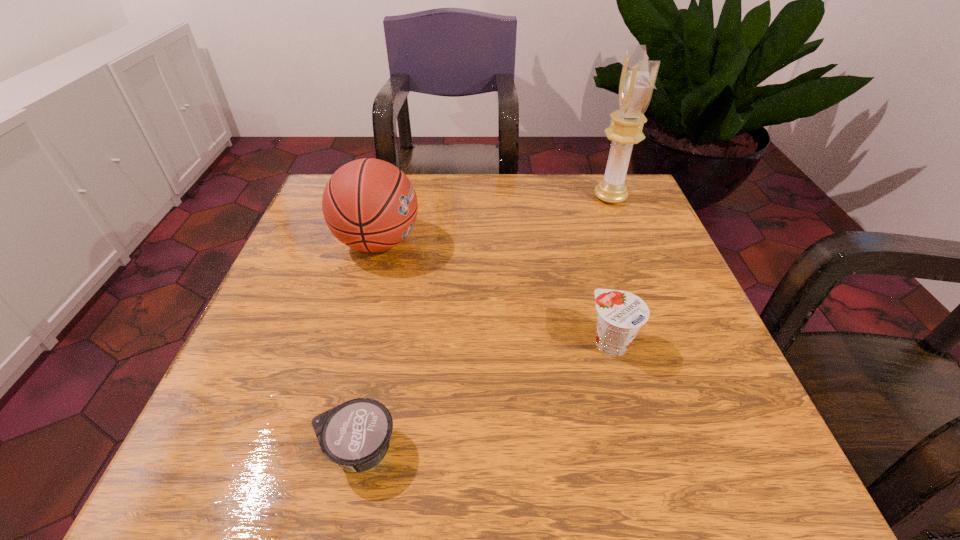
At what (x,y) coordinates should I click in order to perform the action: click on vacant space positioned 0.210m on the front-facing side of the rightmost object. Please return your answer as a coordinate pair (x, y). This screenshot has height=540, width=960. Looking at the image, I should click on (512, 197).

Where is `free space located 0.070m on the logo side of the second farthest object`? The image size is (960, 540). free space located 0.070m on the logo side of the second farthest object is located at coordinates (452, 242).

Locate an element on the screen. The image size is (960, 540). free space located 0.090m on the right of the third tallest object is located at coordinates (685, 343).

This screenshot has height=540, width=960. I want to click on vacant space located on the right of the nearest object, so click(x=596, y=449).

Find the location of a particular element. award that is positioned at the far edge is located at coordinates (638, 76).

Identify the location of basketball at the far edge. This screenshot has width=960, height=540. (370, 205).

Find the location of `object that is at the near edge`. object that is at the near edge is located at coordinates (356, 434).

You are a GUI agent. You are given a task and a screenshot of the screen. Output one action in this format:
    pyautogui.click(x=<x>, y=<y>)
    Task: Click on the object positioned at the left edge
    
    Given the screenshot: What is the action you would take?
    pyautogui.click(x=370, y=205)

Where is `award that is at the right edge`? award that is at the right edge is located at coordinates (638, 76).

Find the location of a particular element. yogurt that is positioned at the right edge is located at coordinates (621, 314).